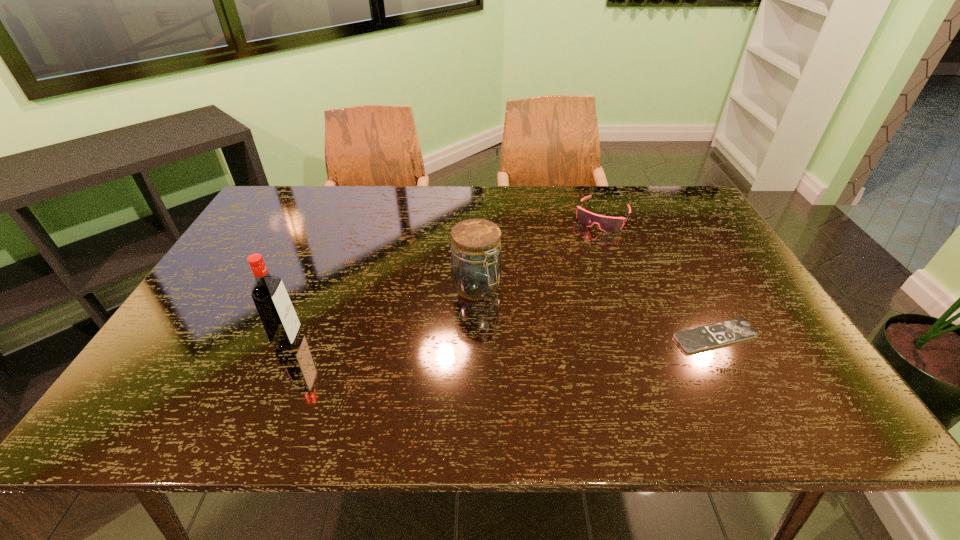
You are a GUI agent. You are given a task and a screenshot of the screen. Output one action in this format:
    pyautogui.click(x=<x>, y=<y>)
    Task: Click on the vacant space on the desktop that is between the vodka and the shortest object and is positioned on the lid of the jar
    
    Given the screenshot: What is the action you would take?
    click(520, 338)

Image resolution: width=960 pixels, height=540 pixels. In order to click on free spot on the desktop that is between the leftmost object and the remote control and is positioned on the front-facing side of the goggles in this screenshot , I will do `click(535, 338)`.